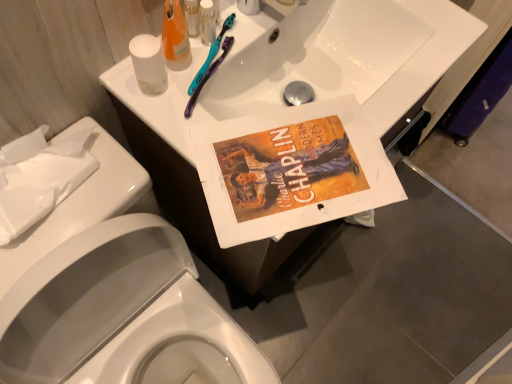
You are a GUI agent. You are given a task and a screenshot of the screen. Output one action in this format:
    pyautogui.click(x=<x>, y=<y>)
    Task: Click on the spots to the right of transparent plastic cup at upper left
    The height and width of the screenshot is (384, 512).
    Given the screenshot: What is the action you would take?
    pyautogui.click(x=251, y=129)